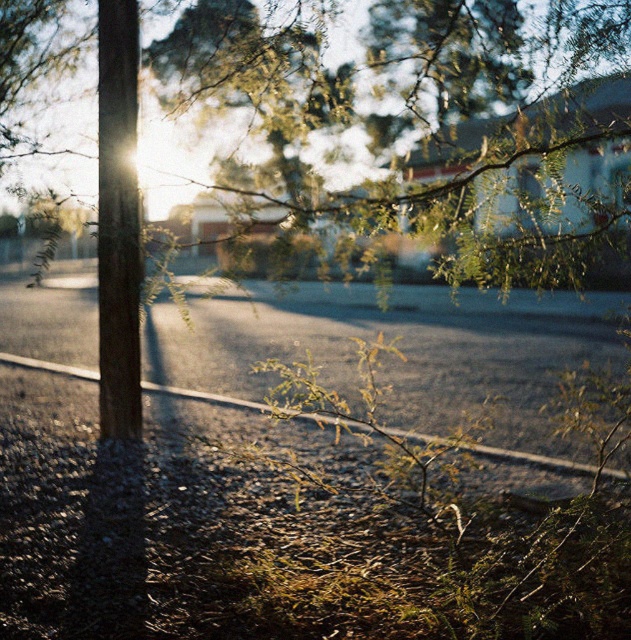
You are a painter standing 10 feet away from the wooden pole at left. You want to paint the green leafy branch at center without moving closer. Can you reach it with your 6 foot long paintbrush?

The green leafy branch at center is 5.33 feet from the wooden pole at left. Since you are 10 feet away from the wooden pole at left, the distance between you and the branch is 10 feet minus 5.33 feet, which equals 4.67 feet. Your 6 foot long paintbrush can easily reach the green leafy branch at center as it is within the 4.67 feet distance.

You are standing in the scene and want to reach the green leafy branch at center. Which direction should you walk to get closer to it?

The green leafy branch at center is located at point (411, 115), so you should walk towards the lower left direction to get closer to it.

You are a painter setting up your easel in this outdoor scene. You want to paint the green leafy branch at center and the wooden pole at left. Which object should you focus on first if you want to paint the larger one first?

The green leafy branch at center is larger in size than the wooden pole at left, so you should focus on painting the green leafy branch at center first.